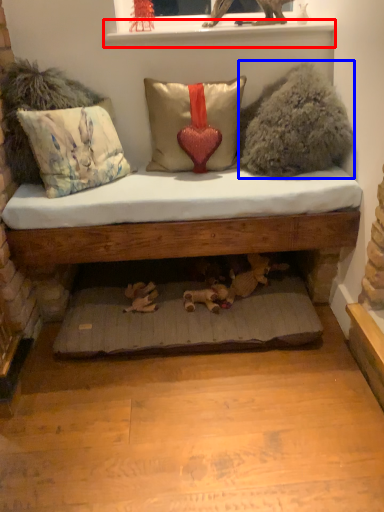
Question: Which point is further to the camera, window sill (highlighted by a red box) or animal (highlighted by a blue box)?

Choices:
 (A) window sill
 (B) animal

Answer: (A)